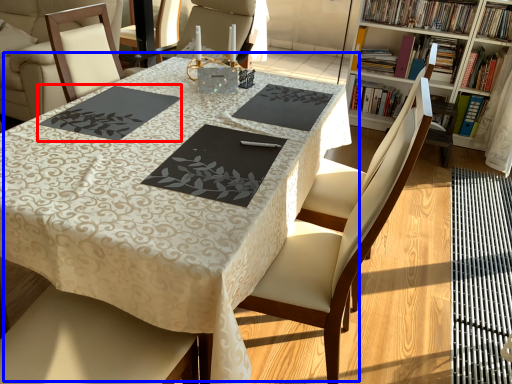
Question: Among these objects, which one is farthest to the camera, place mat (highlighted by a red box) or table (highlighted by a blue box)?

Choices:
 (A) place mat
 (B) table

Answer: (A)